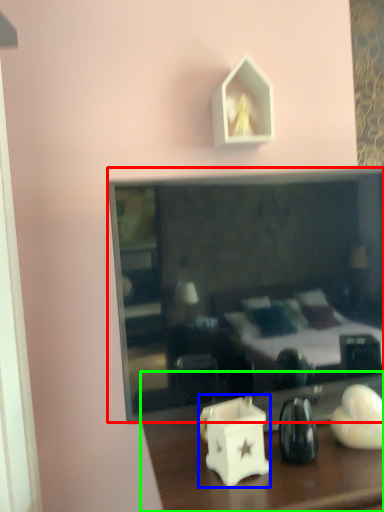
Question: Based on their relative distances, which object is farther from mirror (highlighted by a red box)? Choose from candle holder (highlighted by a blue box) and table (highlighted by a green box).

Choices:
 (A) candle holder
 (B) table

Answer: (A)